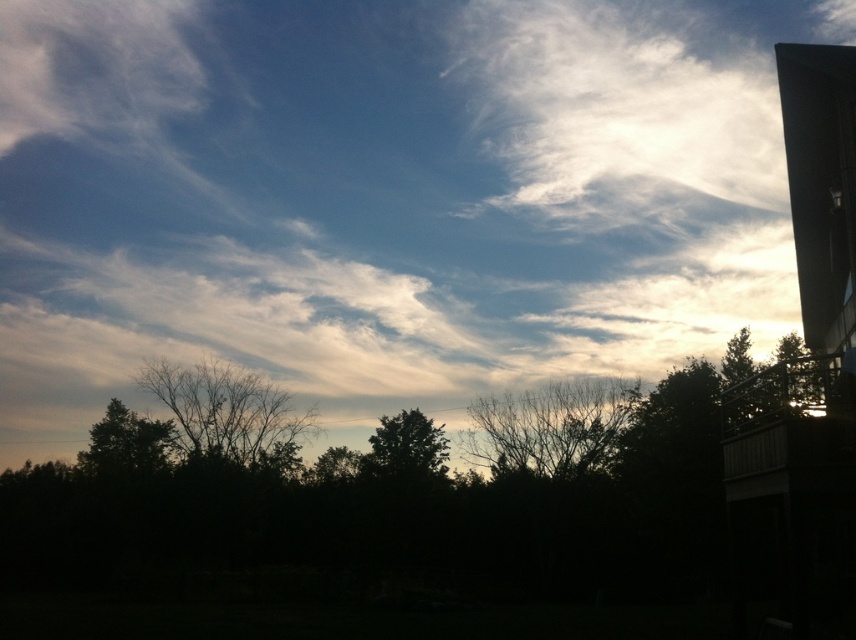
Question: Which of the following is the farthest from the observer?

Choices:
 (A) dark green leafy tree at lower left
 (B) bare branches at center

Answer: (A)

Question: Is dark green leafy tree at lower left further to the viewer compared to green leafy tree at center?

Choices:
 (A) no
 (B) yes

Answer: (B)

Question: Estimate the real-world distances between objects in this image. Which object is farther from the green leafy tree at center?

Choices:
 (A) brown leafless tree at lower left
 (B) bare branches at center

Answer: (A)

Question: Does bare branches at center have a lesser width compared to green leafy tree at center?

Choices:
 (A) yes
 (B) no

Answer: (B)

Question: Observing the image, what is the correct spatial positioning of white fluffy cloud at upper center in reference to dark green leafy tree at lower left?

Choices:
 (A) left
 (B) right

Answer: (B)

Question: Which object is positioned closest to the bare branches at center?

Choices:
 (A) brown leafless tree at lower left
 (B) green leafy tree at center
 (C) dark green leafy tree at lower left

Answer: (B)